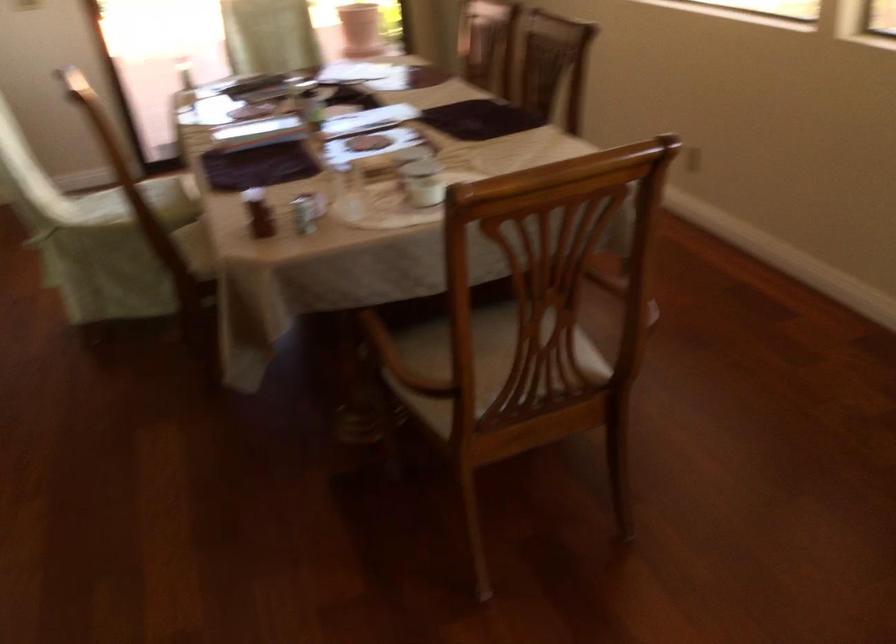
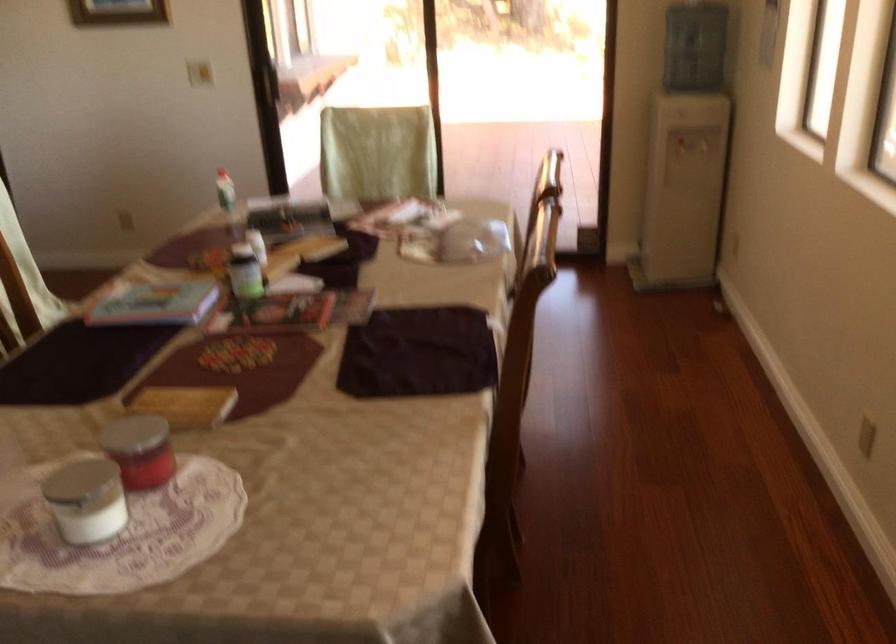
Locate, in the second image, the point that corresponds to point (424, 176) in the first image.

(85, 500)